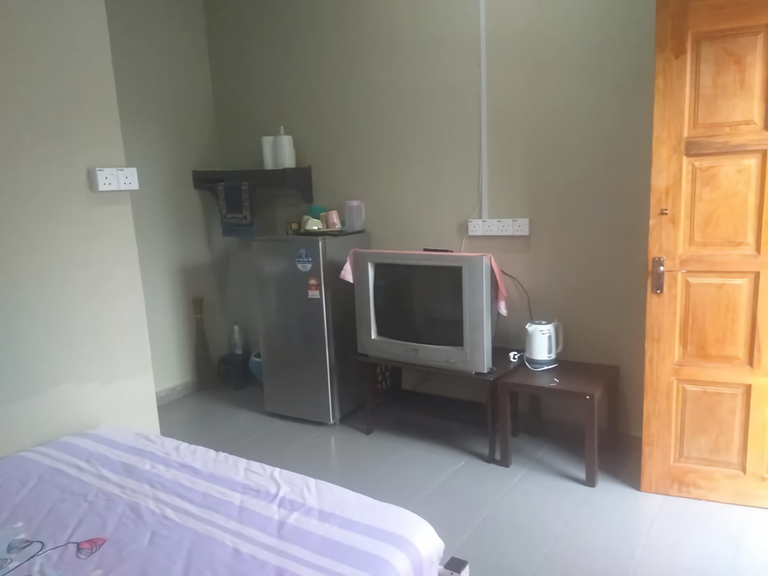
The width and height of the screenshot is (768, 576). I want to click on televison, so click(402, 291).